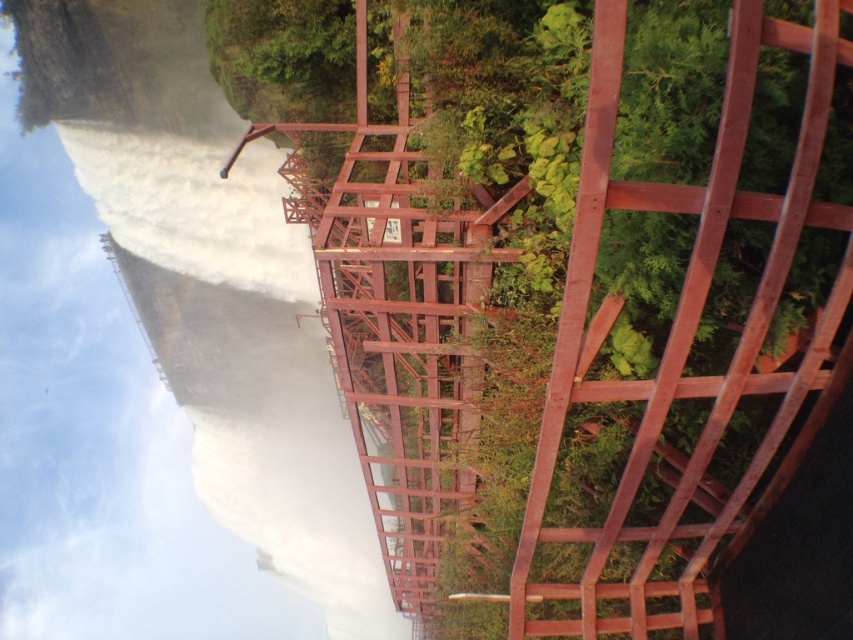
Question: Among these objects, which one is nearest to the camera?

Choices:
 (A) rusty metal bridge at upper center
 (B) white mist at left

Answer: (A)

Question: Can you confirm if rusty metal bridge at upper center is positioned above white mist at left?

Choices:
 (A) yes
 (B) no

Answer: (A)

Question: Does rusty metal bridge at upper center appear under white mist at left?

Choices:
 (A) no
 (B) yes

Answer: (A)

Question: Among these objects, which one is nearest to the camera?

Choices:
 (A) rusty metal bridge at upper center
 (B) white mist at left

Answer: (A)

Question: Is rusty metal bridge at upper center bigger than white mist at left?

Choices:
 (A) yes
 (B) no

Answer: (B)